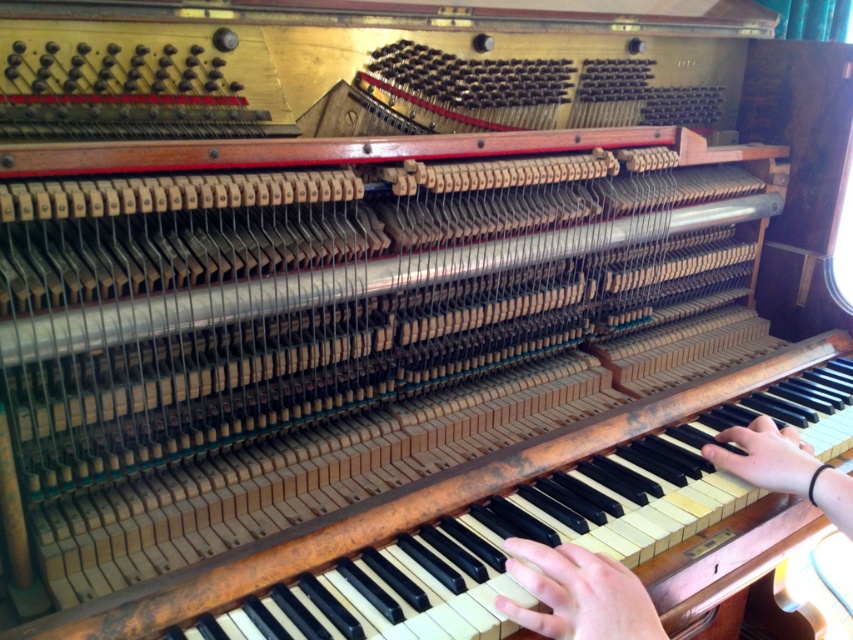
You are a piano technician examining the internal components of a piano. You notice two hands interacting with the mechanism. The smooth skin hand at center is manipulating a hammer, while the light skin tone hand at right is adjusting a string. Which hand is bigger?

The smooth skin hand at center has a larger size compared to the light skin tone hand at right, so the smooth skin hand at center is bigger.

You are a piano technician examining the exposed interior of a piano. You notice two parts labeled as light skin tone flesh at lower center and light skin tone hand at right. Which part has a smaller width?

The light skin tone flesh at lower center has a smaller width than the light skin tone hand at right according to the description.